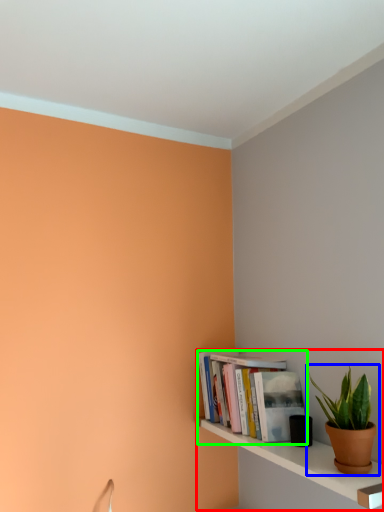
Question: Estimate the real-world distances between objects in this image. Which object is closer to shelf (highlighted by a red box), houseplant (highlighted by a blue box) or book (highlighted by a green box)?

Choices:
 (A) houseplant
 (B) book

Answer: (B)